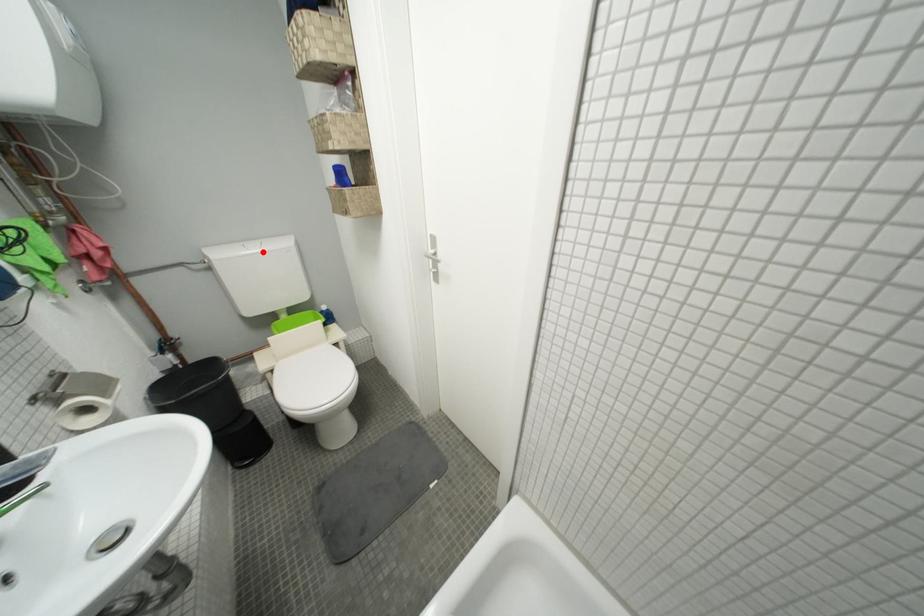
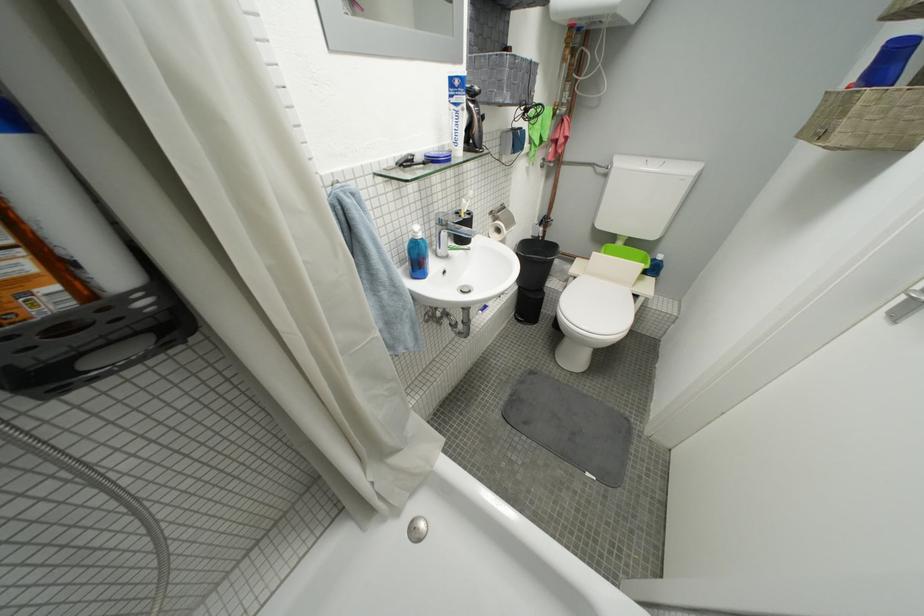
Locate, in the second image, the point that corresponds to the highlighted location in the first image.

(662, 169)